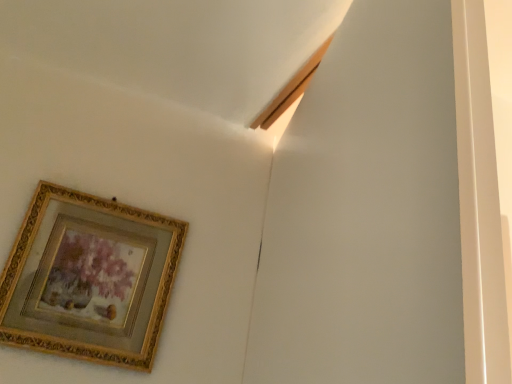
Image resolution: width=512 pixels, height=384 pixels. Describe the element at coordinates (89, 278) in the screenshot. I see `gold/gilded picture frame at upper left` at that location.

Measure the distance between point (x=155, y=339) and camera.

Point (x=155, y=339) and camera are 31.65 inches apart.

The height and width of the screenshot is (384, 512). I want to click on gold/gilded picture frame at upper left, so coord(89,278).

Where is `gold/gilded picture frame at upper left`? This screenshot has height=384, width=512. gold/gilded picture frame at upper left is located at coordinates (89, 278).